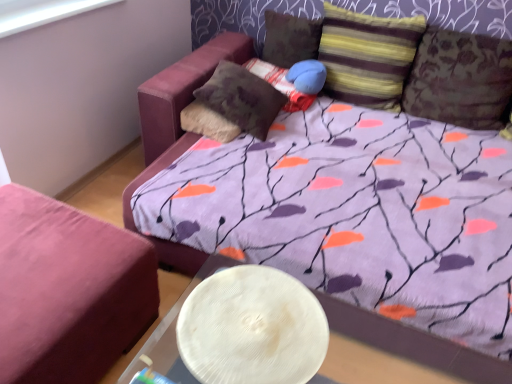
Locate an element on the screen. velvet pink ottoman at lower left is located at coordinates (68, 290).

Find the location of a particular element. This screenshot has height=384, width=512. striped fabric pillow at upper right, the fourth pillow in the left-to-right sequence is located at coordinates pos(368,56).

Measure the distance between point (272,357) and camera.

A distance of 98.40 centimeters exists between point (272,357) and camera.

The width and height of the screenshot is (512, 384). Describe the element at coordinates (252, 328) in the screenshot. I see `white textured plate at lower center` at that location.

Describe the element at coordinates (280, 84) in the screenshot. The height and width of the screenshot is (384, 512). I see `velvet-like brown pillow at center, the 4th pillow when ordered from right to left` at that location.

In order to click on velvet pink ottoman at lower left in this screenshot , I will do `click(68, 290)`.

From a real-world perspective, is striped fabric pillow at upper right, the second pillow viewed from the right, physically located above or below textured brown pillow at upper center, the third pillow when ordered from left to right?

Clearly, from a real-world perspective, striped fabric pillow at upper right, the second pillow viewed from the right, is above textured brown pillow at upper center, the third pillow when ordered from left to right.

How different are the orientations of striped fabric pillow at upper right, the second pillow viewed from the right, and textured brown pillow at upper center, the third pillow when ordered from left to right, in degrees?

striped fabric pillow at upper right, the second pillow viewed from the right, and textured brown pillow at upper center, the third pillow when ordered from left to right, are facing 0.00011 degrees away from each other.

Is point (362, 69) less distant than point (287, 41)?

That is True.

You are a GUI agent. You are given a task and a screenshot of the screen. Output one action in this format:
    pyautogui.click(x=<x>, y=<y>)
    Task: Click on the pillow above the striped fabric pillow at upper right, the second pillow viewed from the right (from the image's perspective)
    Image resolution: width=512 pixels, height=384 pixels.
    Given the screenshot: What is the action you would take?
    pyautogui.click(x=290, y=39)

From a real-world perspective, is textured brown pillow at upper right, the fifth pillow when ordered from left to right, located higher than white textured plate at lower center?

Correct, in the physical world, textured brown pillow at upper right, the fifth pillow when ordered from left to right, is higher than white textured plate at lower center.

Considering the sizes of objects textured brown pillow at upper right, placed as the first pillow when sorted from right to left, and white textured plate at lower center in the image provided, who is bigger, textured brown pillow at upper right, placed as the first pillow when sorted from right to left, or white textured plate at lower center?

textured brown pillow at upper right, placed as the first pillow when sorted from right to left, is bigger.

Which is more to the left, textured brown pillow at upper right, placed as the first pillow when sorted from right to left, or white textured plate at lower center?

Positioned to the left is white textured plate at lower center.

Which is behind, white plastic window screen at upper left or striped fabric pillow at upper right, the second pillow viewed from the right?

striped fabric pillow at upper right, the second pillow viewed from the right, is more distant.

Considering the sizes of objects white plastic window screen at upper left and striped fabric pillow at upper right, the fourth pillow in the left-to-right sequence, in the image provided, who is wider, white plastic window screen at upper left or striped fabric pillow at upper right, the fourth pillow in the left-to-right sequence,?

With larger width is striped fabric pillow at upper right, the fourth pillow in the left-to-right sequence.

Is white plastic window screen at upper left beside striped fabric pillow at upper right, the second pillow viewed from the right?

No.

From a real-world perspective, is velvet-like brown pillow at center, the 4th pillow when ordered from right to left, positioned above or below textured brown pillow at upper right, the fifth pillow when ordered from left to right?

velvet-like brown pillow at center, the 4th pillow when ordered from right to left, is below textured brown pillow at upper right, the fifth pillow when ordered from left to right.

From the picture: Can you confirm if velvet-like brown pillow at center, the 4th pillow when ordered from right to left, is positioned to the right of textured brown pillow at upper right, the fifth pillow when ordered from left to right?

No, velvet-like brown pillow at center, the 4th pillow when ordered from right to left, is not to the right of textured brown pillow at upper right, the fifth pillow when ordered from left to right.

Which is farther, (284, 84) or (414, 100)?

Positioned behind is point (284, 84).

Is velvet-like brown pillow at center, the 4th pillow when ordered from right to left, facing towards textured brown pillow at upper right, the fifth pillow when ordered from left to right?

No.

Which point is more distant from viewer, (283, 33) or (80, 3)?

The point (283, 33) is farther from the camera.

From a real-world perspective, is textured brown pillow at upper center, the third pillow when ordered from left to right, on white plastic window screen at upper left?

No, from a real-world perspective, textured brown pillow at upper center, the third pillow when ordered from left to right, is not on top of white plastic window screen at upper left.

Identify the location of the 5th pillow behind the white plastic window screen at upper left, starting your count from the anchor. (290, 39).

In the scene shown: Considering the sizes of objects textured brown pillow at upper center, the third pillow viewed from the right, and white plastic window screen at upper left in the image provided, who is smaller, textured brown pillow at upper center, the third pillow viewed from the right, or white plastic window screen at upper left?

Smaller between the two is white plastic window screen at upper left.

Between velvet-like brown pillow at center, placed as the second pillow when sorted from left to right, and white plastic window screen at upper left, which one is positioned behind?

velvet-like brown pillow at center, placed as the second pillow when sorted from left to right, is more distant.

Consider the image. From a real-world perspective, which object rests below the other?

velvet-like brown pillow at center, the 4th pillow when ordered from right to left, from a real-world perspective.

The width and height of the screenshot is (512, 384). I want to click on window screen lying in front of the velvet-like brown pillow at center, the 4th pillow when ordered from right to left, so click(x=41, y=12).

Which of these two, velvet-like brown pillow at center, the 4th pillow when ordered from right to left, or white plastic window screen at upper left, is thinner?

Thinner between the two is white plastic window screen at upper left.

Considering the relative sizes of velvet pink ottoman at lower left and textured brown pillow at center, the first pillow viewed from the left, in the image provided, is velvet pink ottoman at lower left smaller than textured brown pillow at center, the first pillow viewed from the left,?

Actually, velvet pink ottoman at lower left might be larger than textured brown pillow at center, the first pillow viewed from the left.

Between velvet pink ottoman at lower left and textured brown pillow at center, positioned as the 5th pillow in right-to-left order, which one has less height?

textured brown pillow at center, positioned as the 5th pillow in right-to-left order, is shorter.

Would you say velvet pink ottoman at lower left is a long distance from textured brown pillow at center, the first pillow viewed from the left?

No, there isn't a large distance between velvet pink ottoman at lower left and textured brown pillow at center, the first pillow viewed from the left.

From a real-world perspective, is velvet pink ottoman at lower left located higher than textured brown pillow at center, the first pillow viewed from the left?

No, from a real-world perspective, velvet pink ottoman at lower left is not on top of textured brown pillow at center, the first pillow viewed from the left.

Identify the location of the 1st pillow counting from the left side of the striped fabric pillow at upper right, the second pillow viewed from the right. Image resolution: width=512 pixels, height=384 pixels. (290, 39).

Find the location of `the 2nd pillow directly above the white textured plate at lower center (from a real-world perspective)`. the 2nd pillow directly above the white textured plate at lower center (from a real-world perspective) is located at coordinates (460, 79).

Based on their spatial positions, is striped fabric pillow at upper right, the fourth pillow in the left-to-right sequence, or textured brown pillow at center, the first pillow viewed from the left, further from white textured plate at lower center?

The object further to white textured plate at lower center is striped fabric pillow at upper right, the fourth pillow in the left-to-right sequence.

From the image, which object appears to be farther from textured brown pillow at upper center, the third pillow viewed from the right, velvet-like brown pillow at center, placed as the second pillow when sorted from left to right, or striped fabric pillow at upper right, the second pillow viewed from the right?

The object further to textured brown pillow at upper center, the third pillow viewed from the right, is striped fabric pillow at upper right, the second pillow viewed from the right.

Looking at the image, which one is located closer to white plastic window screen at upper left, white textured plate at lower center or textured brown pillow at upper right, placed as the first pillow when sorted from right to left?

white textured plate at lower center is positioned closer to the anchor white plastic window screen at upper left.

Looking at the image, which one is located closer to velvet pink ottoman at lower left, white plastic window screen at upper left or velvet-like brown pillow at center, the 4th pillow when ordered from right to left?

white plastic window screen at upper left lies closer to velvet pink ottoman at lower left than the other object.

Based on their spatial positions, is textured brown pillow at upper right, the fifth pillow when ordered from left to right, or velvet pink ottoman at lower left further from white textured plate at lower center?

The object further to white textured plate at lower center is textured brown pillow at upper right, the fifth pillow when ordered from left to right.

Looking at this image, based on their spatial positions, is striped fabric pillow at upper right, the second pillow viewed from the right, or white textured plate at lower center closer to white plastic window screen at upper left?

The object closer to white plastic window screen at upper left is striped fabric pillow at upper right, the second pillow viewed from the right.

Looking at the image, which one is located further to white plastic window screen at upper left, velvet-like brown pillow at center, the 4th pillow when ordered from right to left, or striped fabric pillow at upper right, the second pillow viewed from the right?

striped fabric pillow at upper right, the second pillow viewed from the right.

Considering their positions, is white textured plate at lower center positioned further to velvet pink ottoman at lower left than textured brown pillow at upper center, the third pillow viewed from the right?

textured brown pillow at upper center, the third pillow viewed from the right.

The height and width of the screenshot is (384, 512). I want to click on window screen between white textured plate at lower center and textured brown pillow at upper center, the third pillow when ordered from left to right, from front to back, so click(x=41, y=12).

Identify the location of round table between velvet pink ottoman at lower left and textured brown pillow at upper right, placed as the first pillow when sorted from right to left. The width and height of the screenshot is (512, 384). (252, 328).

Locate an element on the screen. Image resolution: width=512 pixels, height=384 pixels. round table between white plastic window screen at upper left and velvet pink ottoman at lower left in the vertical direction is located at coordinates (252, 328).

Where is `window screen located between white textured plate at lower center and velvet-like brown pillow at center, the 4th pillow when ordered from right to left, in the depth direction`? The height and width of the screenshot is (384, 512). window screen located between white textured plate at lower center and velvet-like brown pillow at center, the 4th pillow when ordered from right to left, in the depth direction is located at coordinates (41, 12).